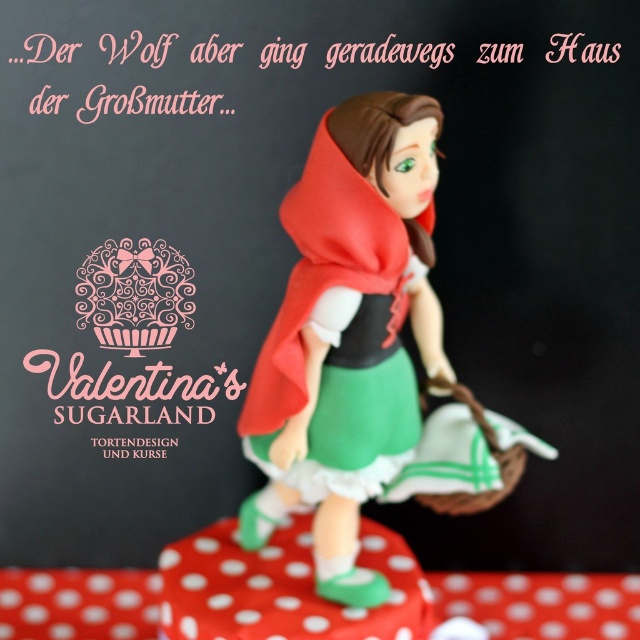
Who is taller, matte red cape at center or red polka dot fabric at lower center?

Standing taller between the two is matte red cape at center.

This screenshot has width=640, height=640. I want to click on matte red cape at center, so click(364, 352).

Is point (352, 572) less distant than point (108, 621)?

No.

I want to click on matte red cape at center, so click(x=364, y=352).

Is red polka dot fabric at lower center wider than pink sugar cupcake at center?

Indeed, red polka dot fabric at lower center has a greater width compared to pink sugar cupcake at center.

Find the location of a particular element. The height and width of the screenshot is (640, 640). red polka dot fabric at lower center is located at coordinates (541, 602).

Between matte red cape at center and pink sugar cupcake at center, which one has less height?

pink sugar cupcake at center

Measure the distance between matte red cape at center and pink sugar cupcake at center.

matte red cape at center is 11.31 inches away from pink sugar cupcake at center.

Is point (285, 342) more distant than point (141, 308)?

No, (285, 342) is closer to viewer.

What are the coordinates of `matte red cape at center` in the screenshot? It's located at (364, 352).